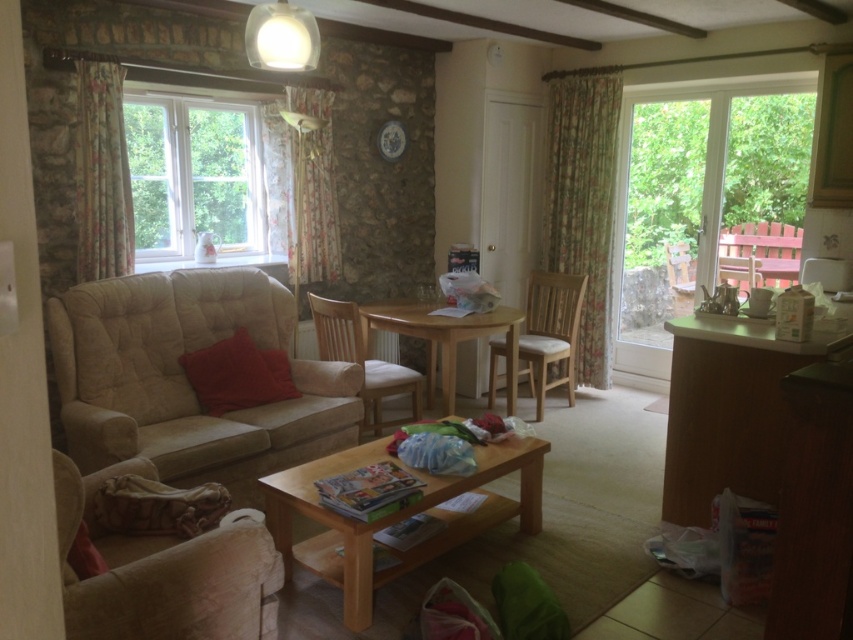
Is wooden table at center thinner than wooden chair at right?

In fact, wooden table at center might be wider than wooden chair at right.

From the picture: Does wooden table at center appear on the right side of wooden chair at right?

No, wooden table at center is not to the right of wooden chair at right.

Which is behind, point (413, 508) or point (694, 289)?

Point (694, 289)

Locate an element on the screen. This screenshot has height=640, width=853. wooden table at center is located at coordinates (395, 515).

Is beige fabric couch at left positioned before floral fabric curtain at right?

Yes, it is.

Can you confirm if beige fabric couch at left is shorter than floral fabric curtain at right?

Yes.

Does point (151, 429) come farther from viewer compared to point (583, 120)?

No, (151, 429) is closer to viewer.

You are a GUI agent. You are given a task and a screenshot of the screen. Output one action in this format:
    pyautogui.click(x=<x>, y=<y>)
    Task: Click on the beige fabric couch at left
    This screenshot has width=853, height=640.
    Given the screenshot: What is the action you would take?
    pyautogui.click(x=187, y=380)

Is floral fabric curtain at right smaller than light wood table at center?

Correct, floral fabric curtain at right occupies less space than light wood table at center.

Between floral fabric curtain at right and light wood table at center, which one is positioned lower?

light wood table at center is lower down.

Image resolution: width=853 pixels, height=640 pixels. Identify the location of floral fabric curtain at right. [x=583, y=204].

Identify the location of floral fabric curtain at right. The image size is (853, 640). (583, 204).